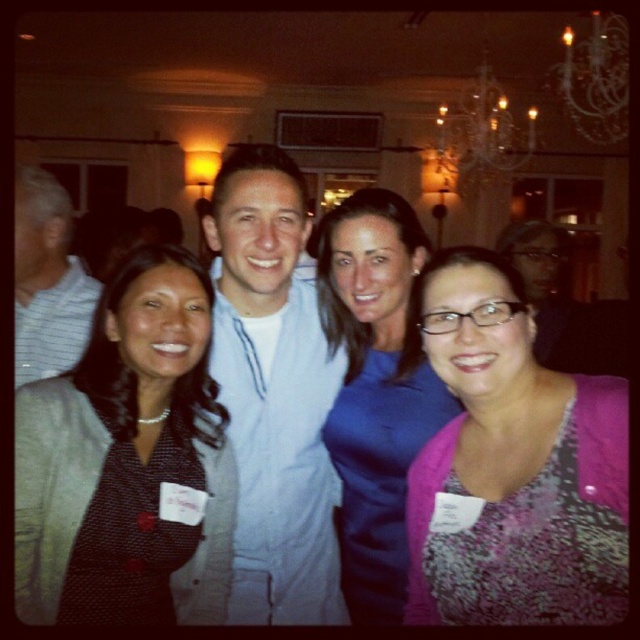
You are standing in the room and want to pick up the pink textured sweater at lower right. Where exactly should you look to find it?

The pink textured sweater at lower right is located at point (515, 467).

You are standing in the room and want to place a small decoration between the two points, point (394, 262) and point (48, 257). Which point should the decoration be closer to in order to appear larger in the photo?

The decoration should be placed closer to point (394, 262) because it is closer to the camera, making objects placed there appear larger in the photo compared to point (48, 257) which is farther away.

You are organizing a photo shoot and need to ensure that the pink textured sweater at lower right and the matte light blue shirt at center can fit side by side on a 1.2 meter wide backdrop. Based on their widths, will they fit together?

The pink textured sweater at lower right might be wider than matte light blue shirt at center, so there is a possibility they may not fit together on a 1.2 meter wide backdrop if the combined width exceeds the space available.